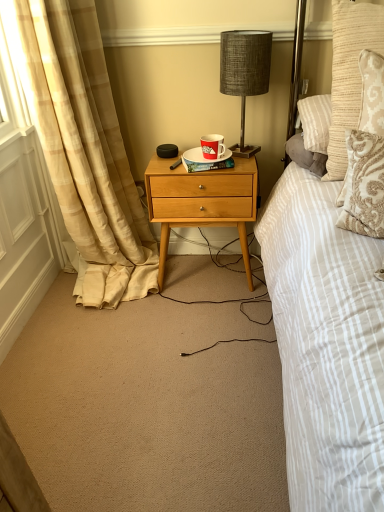
Question: Would you say hardcover book at center is outside white glossy plate at center?

Choices:
 (A) no
 (B) yes

Answer: (B)

Question: Can you confirm if hardcover book at center is taller than white glossy plate at center?

Choices:
 (A) yes
 (B) no

Answer: (A)

Question: From a real-world perspective, is hardcover book at center under white glossy plate at center?

Choices:
 (A) no
 (B) yes

Answer: (B)

Question: Can you confirm if hardcover book at center is thinner than white glossy plate at center?

Choices:
 (A) no
 (B) yes

Answer: (B)

Question: Is hardcover book at center next to white glossy plate at center and touching it?

Choices:
 (A) yes
 (B) no

Answer: (A)

Question: Considering the positions of point (347, 118) and point (187, 160), is point (347, 118) closer or farther from the camera than point (187, 160)?

Choices:
 (A) closer
 (B) farther

Answer: (A)

Question: Visually, is textured beige pillow at upper right positioned to the left or to the right of hardcover book at center?

Choices:
 (A) right
 (B) left

Answer: (A)

Question: From the image's perspective, is textured beige pillow at upper right located above or below hardcover book at center?

Choices:
 (A) below
 (B) above

Answer: (B)

Question: Considering the positions of textured beige pillow at upper right and hardcover book at center in the image, is textured beige pillow at upper right wider or thinner than hardcover book at center?

Choices:
 (A) wide
 (B) thin

Answer: (A)

Question: From the image's perspective, is red paper cup at center positioned above or below white glossy plate at center?

Choices:
 (A) below
 (B) above

Answer: (B)

Question: Is red paper cup at center in front of or behind white glossy plate at center in the image?

Choices:
 (A) front
 (B) behind

Answer: (A)

Question: Is red paper cup at center wider or thinner than white glossy plate at center?

Choices:
 (A) thin
 (B) wide

Answer: (A)

Question: From a real-world perspective, is red paper cup at center physically located above or below white glossy plate at center?

Choices:
 (A) above
 (B) below

Answer: (A)

Question: From the image's perspective, is natural wood nightstand at center positioned above or below red paper cup at center?

Choices:
 (A) above
 (B) below

Answer: (B)

Question: Looking at the image, does natural wood nightstand at center seem bigger or smaller compared to red paper cup at center?

Choices:
 (A) small
 (B) big

Answer: (B)